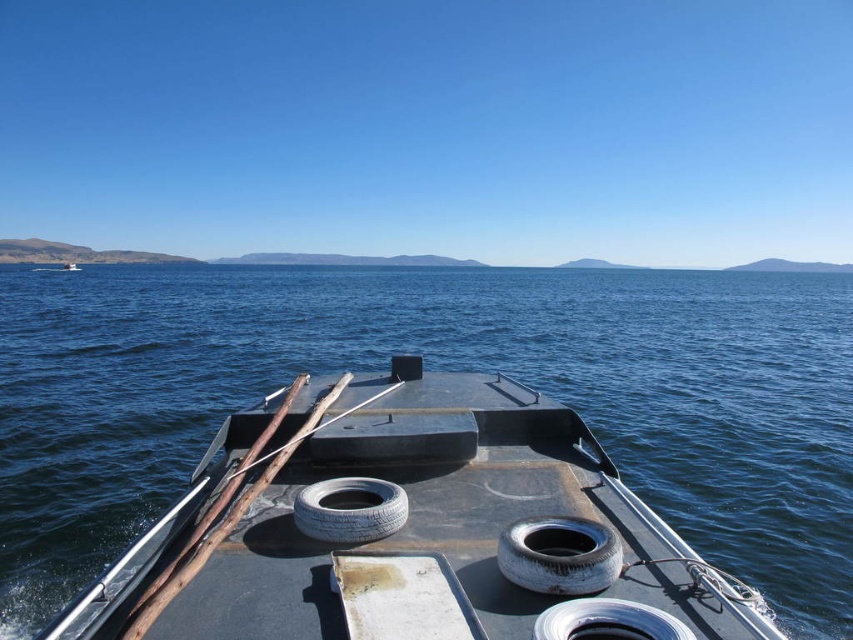
Question: Which point is closer to the camera taking this photo?

Choices:
 (A) click(x=373, y=518)
 (B) click(x=587, y=620)

Answer: (B)

Question: Which point is closer to the camera?

Choices:
 (A) worn rubber tire at center
 (B) white rubber tire at center

Answer: (A)

Question: Can you confirm if rusty metal boat at center is smaller than worn rubber tire at center?

Choices:
 (A) yes
 (B) no

Answer: (B)

Question: Which point appears closest to the camera in this image?

Choices:
 (A) (569, 568)
 (B) (606, 625)
 (C) (125, 600)

Answer: (B)

Question: Does white rubber tire at center have a lesser width compared to silver metallic tire at lower center?

Choices:
 (A) yes
 (B) no

Answer: (B)

Question: Can you confirm if rusty metal boat at center is bigger than white rubber tire at center?

Choices:
 (A) no
 (B) yes

Answer: (B)